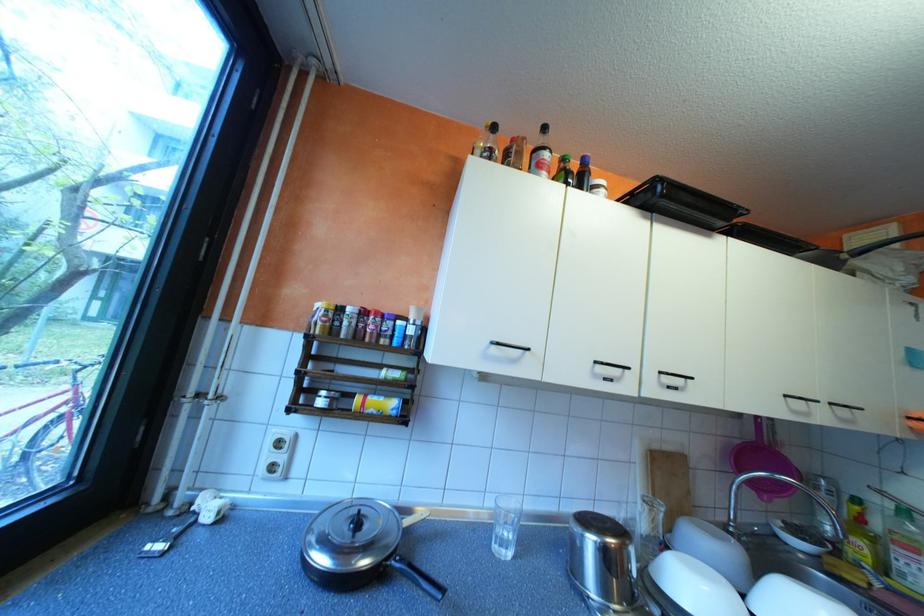
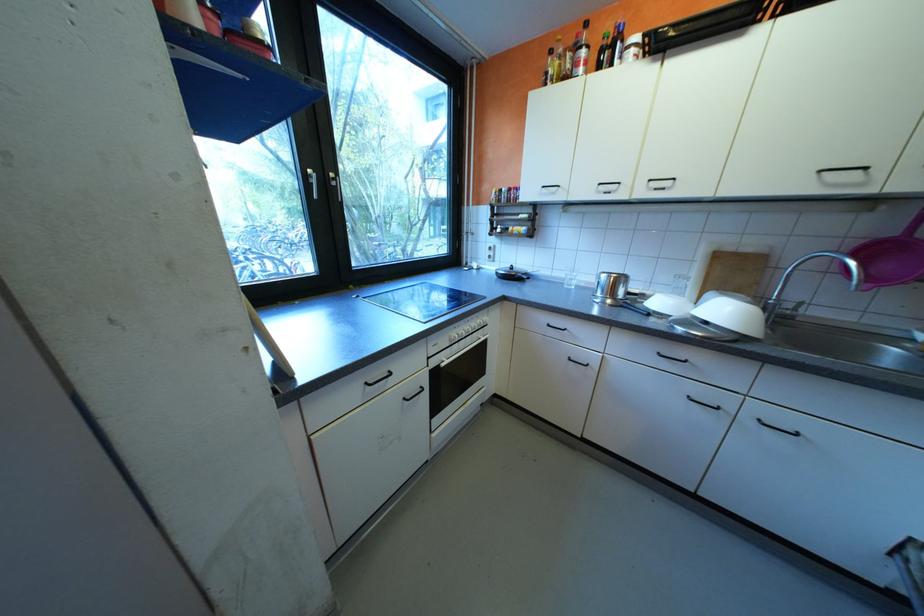
The point at (752, 592) is marked in the first image. Where is the corresponding point in the second image?

(711, 309)